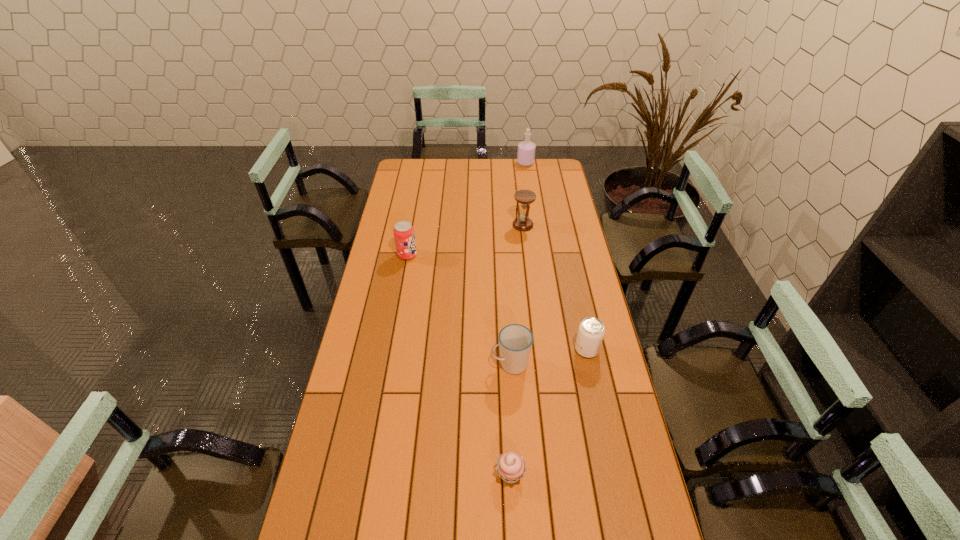
At what (x,y) coordinates should I click in order to perform the action: click on perfume that is positioned at the right edge. Please return your answer as a coordinate pair (x, y). Looking at the image, I should click on (526, 149).

What are the coordinates of `soda can located in the right edge section of the desktop` in the screenshot? It's located at (591, 331).

Locate an element on the screen. This screenshot has height=540, width=960. object present at the far right corner is located at coordinates pyautogui.click(x=526, y=149).

At what (x,y) coordinates should I click in order to perform the action: click on blank space at the left edge of the desktop. Please return your answer as a coordinate pair (x, y). Looking at the image, I should click on (420, 220).

This screenshot has height=540, width=960. In order to click on free space at the right edge of the desktop in this screenshot , I will do (606, 426).

The image size is (960, 540). Find the location of `vacant space at the far left corner of the desktop`. vacant space at the far left corner of the desktop is located at coordinates (412, 177).

At what (x,y) coordinates should I click in order to perform the action: click on vacant area at the far right corner of the desktop. Please return your answer as a coordinate pair (x, y). This screenshot has width=960, height=540. Looking at the image, I should click on (557, 174).

Where is `empty location between the hourglass and the cup`? empty location between the hourglass and the cup is located at coordinates (516, 294).

Find the location of `free space between the shortest object and the leftmost object`. free space between the shortest object and the leftmost object is located at coordinates (459, 364).

Identify the location of vacant space that's between the shorter soda can and the nearest object. Image resolution: width=960 pixels, height=540 pixels. (548, 411).